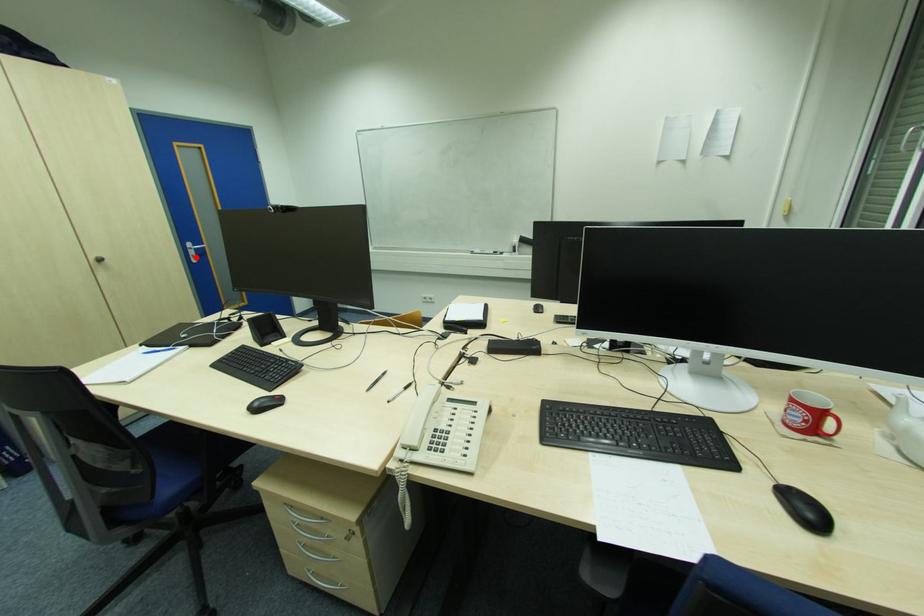
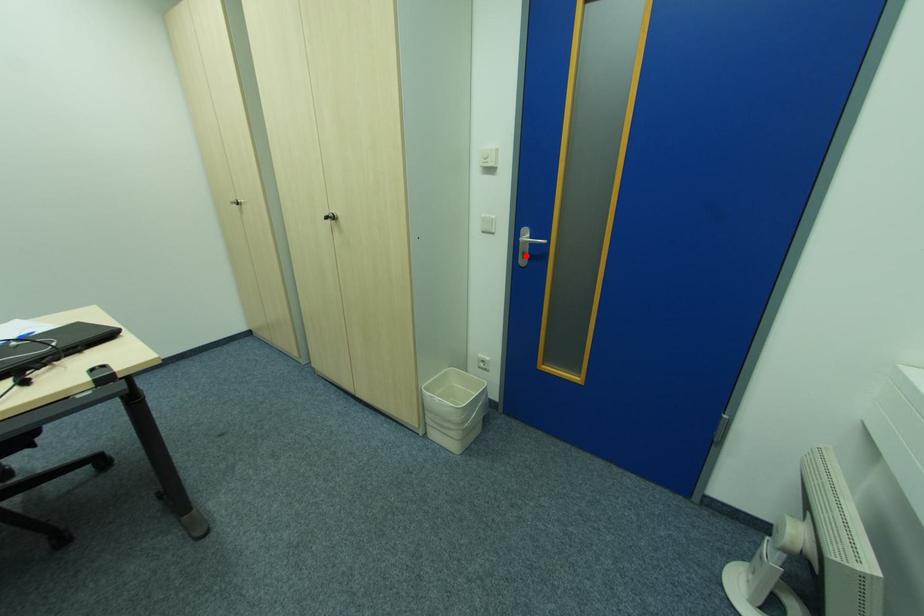
I am providing you with two images of the same scene from different viewpoints. A red point is marked on the first image and another point is marked on the second image. Is the marked point in image1 the same physical position as the marked point in image2?

Yes